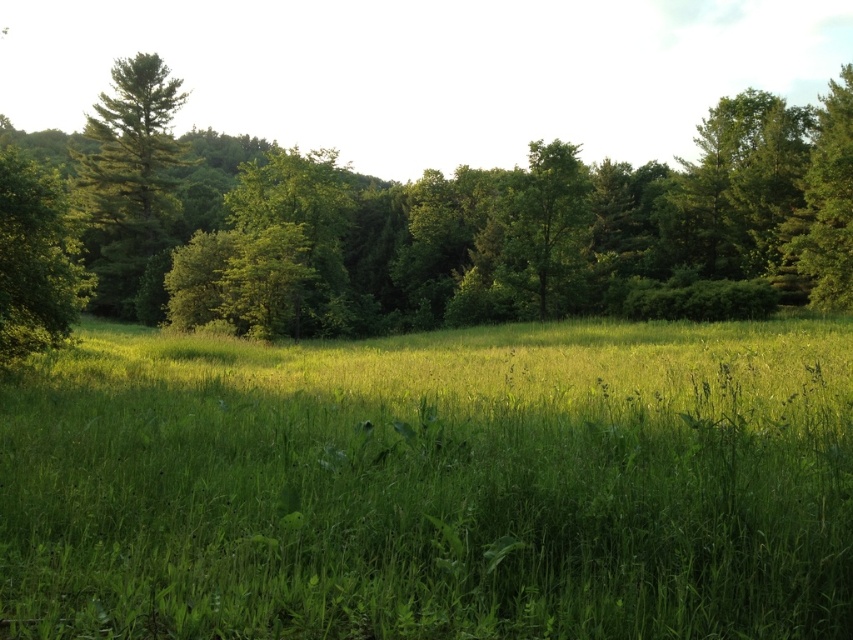
You are standing in the meadow and want to walk towards the forest. Which direction should you go relative to the green matte tree at left and the green grassy pasture at center?

To reach the forest, you should walk to the right of the green matte tree at left, as the green grassy pasture at center is located to its right and leads towards the forest.

You are a hiker trying to determine the best path to avoid tall vegetation. You notice the green leafy forest at center and the green matte tree at left. Which of these two would require you to walk around due to its height?

The green leafy forest at center is much taller than the green matte tree at left, so you would need to walk around the green leafy forest at center.

From the picture: You are standing at the point marked as point (432,483) in the image. What is the name of the object you are currently standing on?

The green grassy pasture at center is located at point (432,483), so you are standing on the green grassy pasture at center.